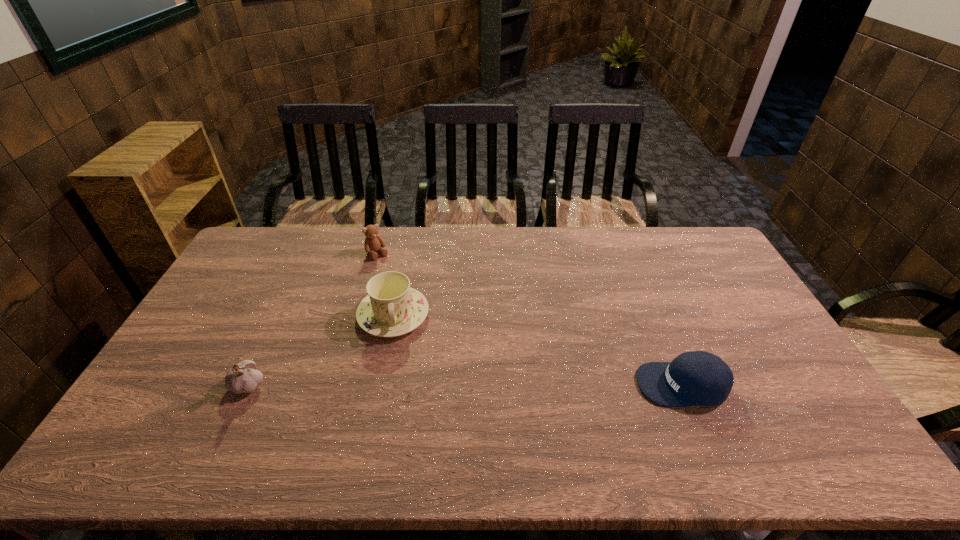
Where is `vacant area at the right edge`? The height and width of the screenshot is (540, 960). vacant area at the right edge is located at coordinates (734, 278).

At what (x,y) coordinates should I click in order to perform the action: click on free space at the far right corner of the desktop. Please return your answer as a coordinate pair (x, y). Looking at the image, I should click on (706, 235).

Locate an element on the screen. The height and width of the screenshot is (540, 960). vacant point located between the chinaware and the shortest object is located at coordinates (538, 350).

Find the location of `free space between the leftmost object and the rightmost object`. free space between the leftmost object and the rightmost object is located at coordinates (466, 384).

At what (x,y) coordinates should I click in order to perform the action: click on vacant area between the second farthest object and the baseball cap. Please return your answer as a coordinate pair (x, y). This screenshot has width=960, height=540. Looking at the image, I should click on 538,350.

This screenshot has height=540, width=960. Identify the location of free spot between the leftmost object and the second farthest object. (322, 349).

This screenshot has height=540, width=960. I want to click on vacant space in between the leftmost object and the baseball cap, so click(x=466, y=384).

This screenshot has height=540, width=960. What are the coordinates of `vacant area that lies between the teddy bear and the baseball cap` in the screenshot? It's located at (530, 319).

I want to click on vacant area that lies between the leftmost object and the rightmost object, so click(x=466, y=384).

At what (x,y) coordinates should I click in order to perform the action: click on vacant region between the farthest object and the rightmost object. Please return your answer as a coordinate pair (x, y). The height and width of the screenshot is (540, 960). Looking at the image, I should click on (530, 319).